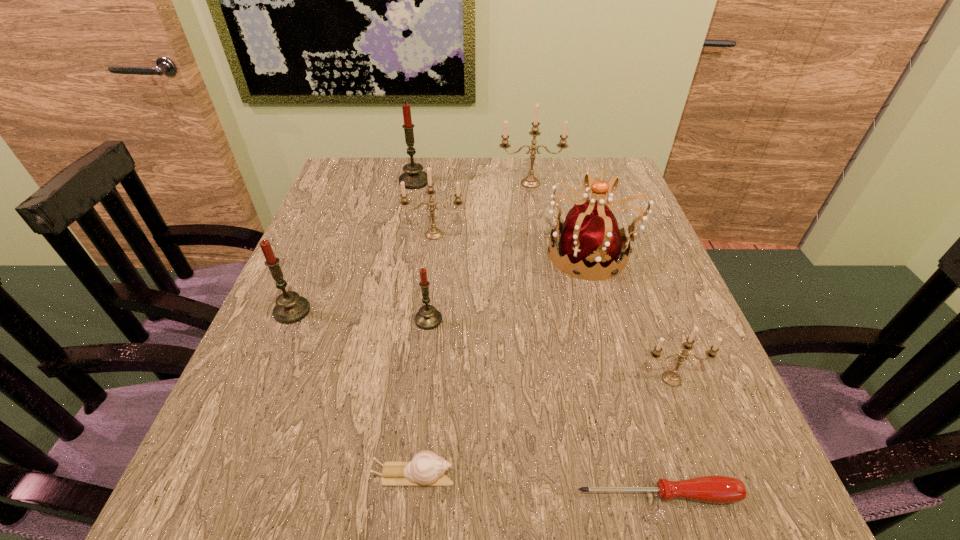
The width and height of the screenshot is (960, 540). I want to click on vacant space situated on the back of the second smallest red candle, so click(x=342, y=193).

You are a GUI agent. You are given a task and a screenshot of the screen. Output one action in this format:
    pyautogui.click(x=<x>, y=<y>)
    Task: Click on the free space located on the right of the leftmost metallic candle
    
    Given the screenshot: What is the action you would take?
    pyautogui.click(x=523, y=235)

Identify the location of vacant region located on the back of the smallest red candle. (433, 276).

The width and height of the screenshot is (960, 540). Find the location of `vacant space located 0.080m on the left of the third nearest object`. vacant space located 0.080m on the left of the third nearest object is located at coordinates (593, 379).

This screenshot has width=960, height=540. In order to click on free space located 0.290m on the shell of the eighth tallest object in this screenshot , I will do `click(653, 476)`.

Locate an element on the screen. vacant area located 0.060m on the left of the red screwdriver is located at coordinates (534, 495).

At what (x,y) coordinates should I click in order to perform the action: click on escargot that is at the near edge. Please return your answer as a coordinate pair (x, y). This screenshot has height=540, width=960. Looking at the image, I should click on (426, 468).

Where is `screwdriver that is at the near edge`? Image resolution: width=960 pixels, height=540 pixels. screwdriver that is at the near edge is located at coordinates (716, 489).

This screenshot has width=960, height=540. In order to click on object present at the left edge in this screenshot , I will do `click(290, 308)`.

Identify the location of tiara at the right edge. (590, 238).